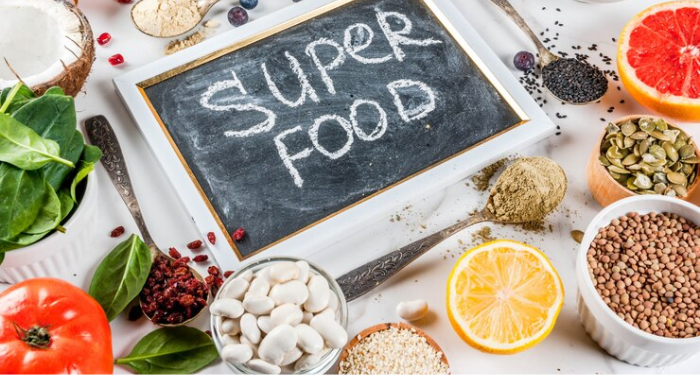
This screenshot has width=700, height=375. Identify the location of frame. (136, 77).